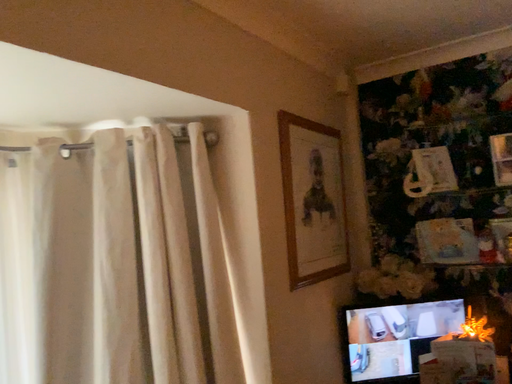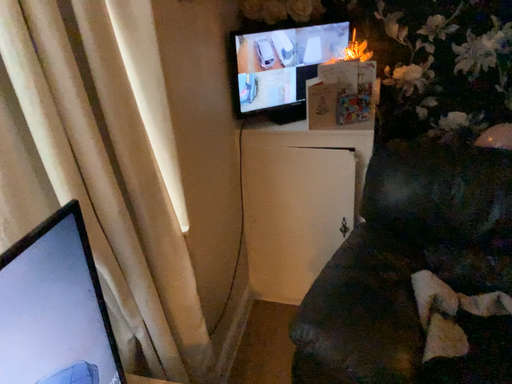
Question: Which way did the camera rotate in the video?

Choices:
 (A) rotated downward
 (B) rotated upward

Answer: (A)